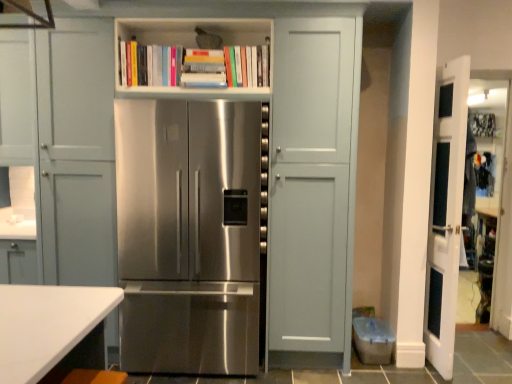
Question: Is point (140, 132) closer or farther from the camera than point (237, 24)?

Choices:
 (A) closer
 (B) farther

Answer: (A)

Question: Is stainless steel refrigerator at center taller or shorter than white matte bookshelf at upper center?

Choices:
 (A) short
 (B) tall

Answer: (B)

Question: Considering the real-world distances, which object is closest to the stainless steel refrigerator at center?

Choices:
 (A) white glossy door at right
 (B) white matte bookshelf at upper center

Answer: (B)

Question: Based on their relative distances, which object is farther from the stainless steel refrigerator at center?

Choices:
 (A) white glossy door at right
 (B) white matte bookshelf at upper center

Answer: (A)